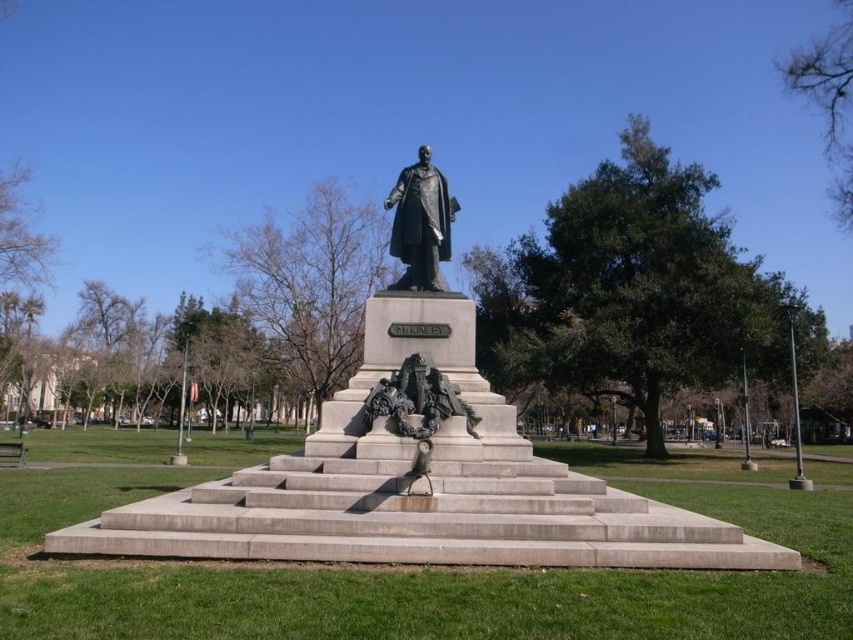
Does bronze statue at center have a lesser width compared to bronze dragon at center?

Yes, bronze statue at center is thinner than bronze dragon at center.

Does bronze statue at center have a greater width compared to bronze dragon at center?

In fact, bronze statue at center might be narrower than bronze dragon at center.

Where is `bronze statue at center`? The width and height of the screenshot is (853, 640). bronze statue at center is located at coordinates (421, 224).

Locate an element on the screen. bronze statue at center is located at coordinates (421, 224).